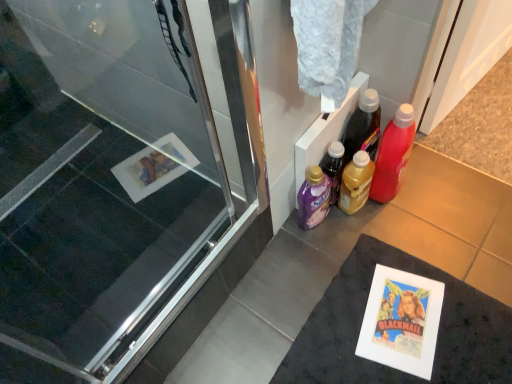
Question: In the image, is transparent glass screen door at left positioned in front of or behind purple plastic bottle at lower center, which is the third bottle in right-to-left order?

Choices:
 (A) behind
 (B) front

Answer: (B)

Question: From the image's perspective, is transparent glass screen door at left above or below purple plastic bottle at lower center, acting as the first bottle starting from the left?

Choices:
 (A) above
 (B) below

Answer: (B)

Question: Which of these objects is positioned closest to the white matte bath mat at lower right?

Choices:
 (A) purple plastic bottle at lower center, acting as the first bottle starting from the left
 (B) transparent glass screen door at left
 (C) translucent plastic bottle at center-right, positioned as the 2th bottle in left-to-right order
 (D) translucent plastic bottle at right, the 3th bottle when ordered from left to right

Answer: (C)

Question: Which object is the farthest from the white matte bath mat at lower right?

Choices:
 (A) translucent plastic bottle at right, the 3th bottle when ordered from left to right
 (B) purple plastic bottle at lower center, which is the third bottle in right-to-left order
 (C) transparent glass screen door at left
 (D) translucent plastic bottle at center-right, positioned as the 2th bottle in left-to-right order

Answer: (C)